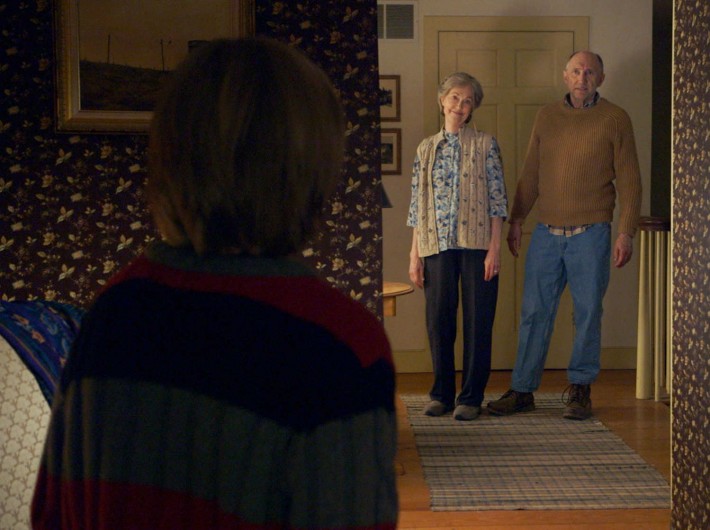
Image resolution: width=710 pixels, height=530 pixels. I want to click on rug, so click(x=476, y=448).